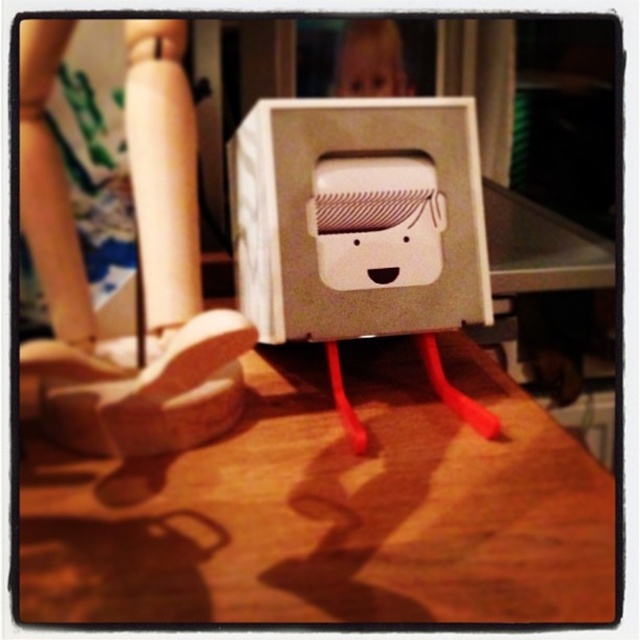
Question: Which point is closer to the camera taking this photo?

Choices:
 (A) (68, 266)
 (B) (346, 93)

Answer: (A)

Question: Does white cardboard box at center appear on the left side of matte plastic face at upper center?

Choices:
 (A) yes
 (B) no

Answer: (A)

Question: Is wooden table at lower center to the right of matte plastic face at upper center from the viewer's perspective?

Choices:
 (A) yes
 (B) no

Answer: (B)

Question: Which point is farther to the camera?

Choices:
 (A) matte plastic doll at lower left
 (B) white cardboard box at center

Answer: (B)

Question: Does wooden table at lower center appear over matte plastic doll at lower left?

Choices:
 (A) yes
 (B) no

Answer: (B)

Question: Which is nearer to the white cardboard box at center?

Choices:
 (A) matte plastic face at upper center
 (B) matte plastic doll at lower left
 (C) wooden table at lower center

Answer: (B)